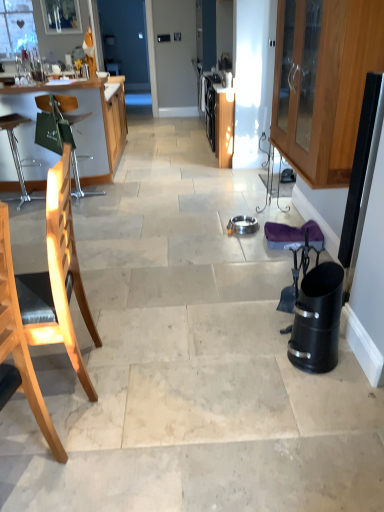
Question: Looking at the image, does light wood chair at left, the second chair positioned from the front, seem bigger or smaller compared to light wood chair at left, the 1th chair when ordered from front to back?

Choices:
 (A) small
 (B) big

Answer: (B)

Question: In the image, is light wood chair at left, the second chair positioned from the front, on the left side or the right side of light wood chair at left, which is the third chair from back to front?

Choices:
 (A) left
 (B) right

Answer: (A)

Question: Which of these objects is positioned closest to the black plastic trash can at right?

Choices:
 (A) matte glass window screen at upper left
 (B) light wood chair at left, which is the third chair from back to front
 (C) black plastic swivel chair at right
 (D) green fabric bag at left
 (E) transparent glass screen door at upper center

Answer: (C)

Question: Which object is the closest to the wooden cabinet at right?

Choices:
 (A) black plastic trash can at right
 (B) black plastic swivel chair at right
 (C) light wood chair at left, positioned as the 2th chair in back-to-front order
 (D) green fabric bag at left
 (E) wooden chair at left, positioned as the third chair in front-to-back order

Answer: (A)